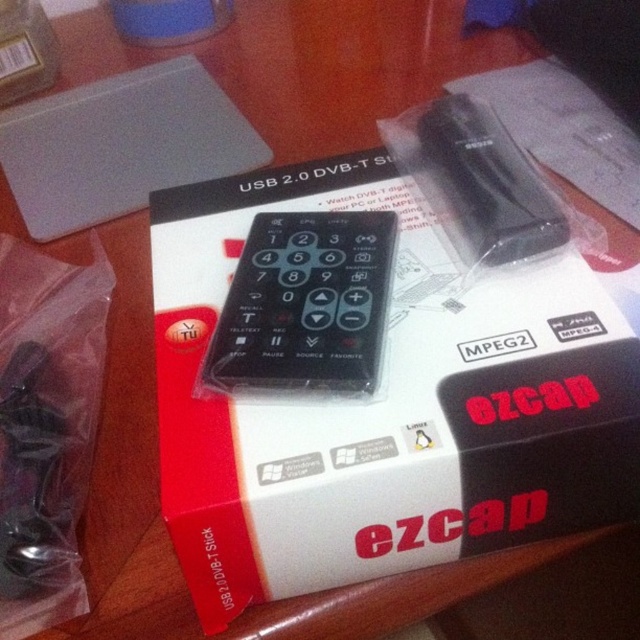
Question: Is black matte remote at center above black plastic remote at upper center?

Choices:
 (A) yes
 (B) no

Answer: (B)

Question: Among these objects, which one is nearest to the camera?

Choices:
 (A) black matte remote at center
 (B) black plastic box at center

Answer: (B)

Question: Is black plastic box at center smaller than black matte remote at center?

Choices:
 (A) yes
 (B) no

Answer: (B)

Question: Is black plastic box at center closer to camera compared to black matte remote at center?

Choices:
 (A) no
 (B) yes

Answer: (B)

Question: Which is farther from the black plastic box at center?

Choices:
 (A) black plastic remote at upper center
 (B) black matte remote at center

Answer: (A)

Question: Which object is closer to the camera taking this photo?

Choices:
 (A) black plastic box at center
 (B) black matte remote at center
 (C) black plastic remote at upper center

Answer: (A)